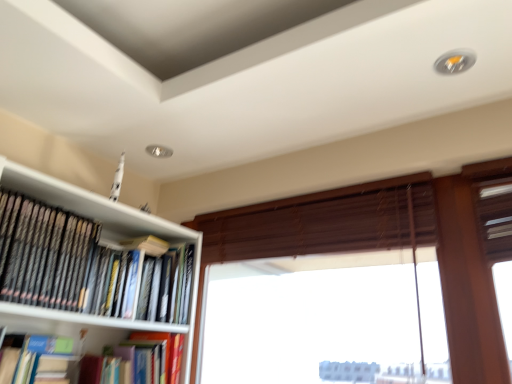
Question: Does black matte bookshelf at upper left, marked as the third book in a bottom-to-top arrangement, have a larger size compared to blue matte book at lower left, marked as the 2th book in a bottom-to-top arrangement?

Choices:
 (A) yes
 (B) no

Answer: (A)

Question: Is black matte bookshelf at upper left, marked as the third book in a bottom-to-top arrangement, next to blue matte book at lower left, the second book from the top?

Choices:
 (A) no
 (B) yes

Answer: (A)

Question: Considering the relative sizes of black matte bookshelf at upper left, marked as the third book in a bottom-to-top arrangement, and blue matte book at lower left, marked as the 2th book in a bottom-to-top arrangement, in the image provided, is black matte bookshelf at upper left, marked as the third book in a bottom-to-top arrangement, smaller than blue matte book at lower left, marked as the 2th book in a bottom-to-top arrangement,?

Choices:
 (A) yes
 (B) no

Answer: (B)

Question: Is black matte bookshelf at upper left, marked as the third book in a bottom-to-top arrangement, closer to the viewer compared to blue matte book at lower left, marked as the 2th book in a bottom-to-top arrangement?

Choices:
 (A) no
 (B) yes

Answer: (B)

Question: Are black matte bookshelf at upper left, which is the 1th book in top-to-bottom order, and blue matte book at lower left, the second book from the top, located far from each other?

Choices:
 (A) yes
 (B) no

Answer: (B)

Question: Does black matte bookshelf at upper left, marked as the third book in a bottom-to-top arrangement, appear on the left side of blue matte book at lower left, marked as the 2th book in a bottom-to-top arrangement?

Choices:
 (A) yes
 (B) no

Answer: (B)

Question: Does hardcover book at center, acting as the third book starting from the top, have a greater height compared to brown wooden blind at center?

Choices:
 (A) yes
 (B) no

Answer: (B)

Question: Is hardcover book at center, which ranks as the first book in bottom-to-top order, turned away from brown wooden blind at center?

Choices:
 (A) no
 (B) yes

Answer: (A)

Question: Can you confirm if hardcover book at center, acting as the third book starting from the top, is thinner than brown wooden blind at center?

Choices:
 (A) no
 (B) yes

Answer: (A)

Question: Does hardcover book at center, which ranks as the first book in bottom-to-top order, appear on the left side of brown wooden blind at center?

Choices:
 (A) no
 (B) yes

Answer: (B)

Question: From a real-world perspective, is hardcover book at center, acting as the third book starting from the top, physically above brown wooden blind at center?

Choices:
 (A) no
 (B) yes

Answer: (A)

Question: Can you confirm if hardcover book at center, which ranks as the first book in bottom-to-top order, is bigger than brown wooden blind at center?

Choices:
 (A) no
 (B) yes

Answer: (A)

Question: From the image's perspective, would you say black matte bookshelf at upper left, which is the 1th book in top-to-bottom order, is shown under brown wooden blind at center?

Choices:
 (A) yes
 (B) no

Answer: (A)